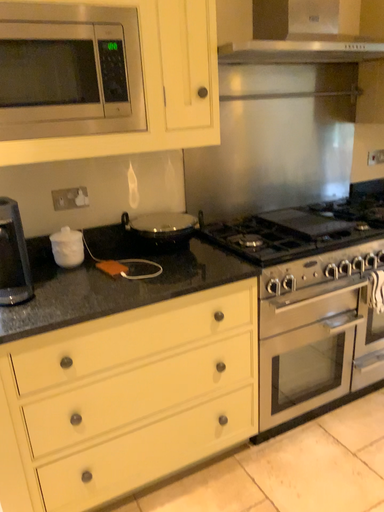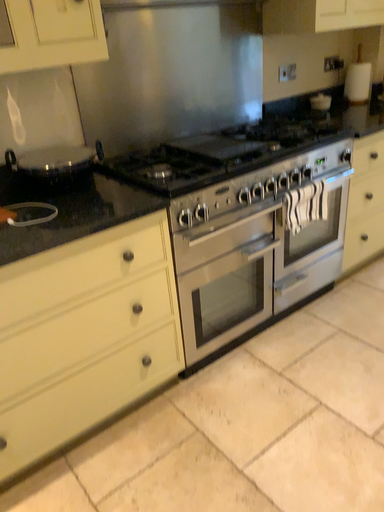
Question: How did the camera likely rotate when shooting the video?

Choices:
 (A) rotated right
 (B) rotated left

Answer: (A)